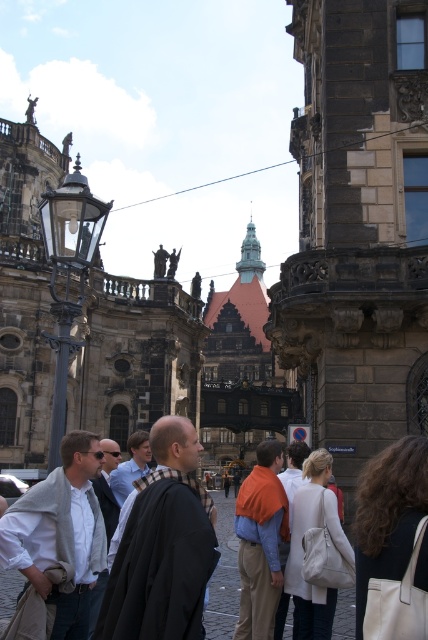
Is black woolen robe at center above light gray woolen robe at left?

Actually, black woolen robe at center is below light gray woolen robe at left.

Is point (163, 624) behind point (5, 557)?

No, (163, 624) is in front of (5, 557).

Find the location of `black woolen robe at center`. black woolen robe at center is located at coordinates (160, 566).

Between light gray woolen robe at left and plaid wool scarf at center, which one is positioned higher?

Positioned higher is plaid wool scarf at center.

Is point (61, 509) farther from camera compared to point (140, 460)?

That is False.

Where is `light gray woolen robe at left`? The height and width of the screenshot is (640, 428). light gray woolen robe at left is located at coordinates (56, 548).

Does point (208, 554) lie in front of point (388, 461)?

Yes, point (208, 554) is closer to viewer.

Between black woolen robe at center and dark brown leather bag at lower right, which one appears on the left side from the viewer's perspective?

From the viewer's perspective, black woolen robe at center appears more on the left side.

Does point (140, 522) come closer to viewer compared to point (359, 628)?

No, it is behind (359, 628).

Where is `black woolen robe at center`? black woolen robe at center is located at coordinates tap(160, 566).